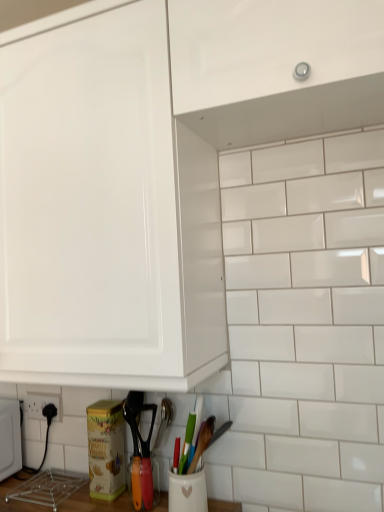
Question: Is black plastic electric outlet at lower left surrounding glossy white cabinet at upper center?

Choices:
 (A) yes
 (B) no

Answer: (B)

Question: Is black plastic electric outlet at lower left thinner than glossy white cabinet at upper center?

Choices:
 (A) yes
 (B) no

Answer: (A)

Question: Is black plastic electric outlet at lower left not close to glossy white cabinet at upper center?

Choices:
 (A) yes
 (B) no

Answer: (A)

Question: Does black plastic electric outlet at lower left lie behind glossy white cabinet at upper center?

Choices:
 (A) no
 (B) yes

Answer: (B)

Question: Does black plastic electric outlet at lower left have a greater height compared to glossy white cabinet at upper center?

Choices:
 (A) no
 (B) yes

Answer: (A)

Question: From a real-world perspective, is wooden spatula at lower center above or below black plastic electric outlet at lower left?

Choices:
 (A) above
 (B) below

Answer: (B)

Question: Is point (137, 483) closer or farther from the camera than point (52, 399)?

Choices:
 (A) farther
 (B) closer

Answer: (B)

Question: Is wooden spatula at lower center spatially inside black plastic electric outlet at lower left, or outside of it?

Choices:
 (A) inside
 (B) outside

Answer: (B)

Question: From the image's perspective, is wooden spatula at lower center positioned above or below black plastic electric outlet at lower left?

Choices:
 (A) above
 (B) below

Answer: (B)

Question: Based on their positions, is wooden spatula at lower center located to the left or right of glossy white cabinet at upper center?

Choices:
 (A) right
 (B) left

Answer: (B)

Question: From the image's perspective, is wooden spatula at lower center positioned above or below glossy white cabinet at upper center?

Choices:
 (A) above
 (B) below

Answer: (B)

Question: Considering the positions of wooden spatula at lower center and glossy white cabinet at upper center in the image, is wooden spatula at lower center taller or shorter than glossy white cabinet at upper center?

Choices:
 (A) short
 (B) tall

Answer: (A)

Question: Is wooden spatula at lower center bigger or smaller than glossy white cabinet at upper center?

Choices:
 (A) small
 (B) big

Answer: (A)

Question: Is point (350, 1) positioned closer to the camera than point (144, 482)?

Choices:
 (A) closer
 (B) farther

Answer: (A)

Question: Is glossy white cabinet at upper center wider or thinner than wooden spatula at lower center?

Choices:
 (A) wide
 (B) thin

Answer: (A)